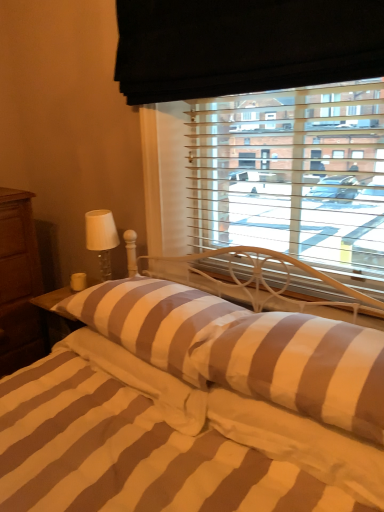
Question: Are brown striped pillow at center, positioned as the 1th pillow in right-to-left order, and striped fabric bed at center far apart?

Choices:
 (A) no
 (B) yes

Answer: (A)

Question: Can you confirm if brown striped pillow at center, positioned as the second pillow in left-to-right order, is bigger than striped fabric bed at center?

Choices:
 (A) no
 (B) yes

Answer: (A)

Question: Is brown striped pillow at center, positioned as the 1th pillow in right-to-left order, with striped fabric bed at center?

Choices:
 (A) no
 (B) yes

Answer: (A)

Question: Can you confirm if brown striped pillow at center, positioned as the second pillow in left-to-right order, is positioned to the right of striped fabric bed at center?

Choices:
 (A) no
 (B) yes

Answer: (B)

Question: Is brown striped pillow at center, positioned as the second pillow in left-to-right order, aimed at striped fabric bed at center?

Choices:
 (A) yes
 (B) no

Answer: (A)

Question: Choose the correct answer: Is brown striped pillow at center, which is the second pillow from right to left, inside white glass table lamp at left or outside it?

Choices:
 (A) outside
 (B) inside

Answer: (A)

Question: From a real-world perspective, is brown striped pillow at center, which is the second pillow from right to left, physically located above or below white glass table lamp at left?

Choices:
 (A) below
 (B) above

Answer: (A)

Question: Considering their positions, is brown striped pillow at center, the 1th pillow in the left-to-right sequence, located in front of or behind white glass table lamp at left?

Choices:
 (A) behind
 (B) front

Answer: (B)

Question: From the image's perspective, relative to white glass table lamp at left, is brown striped pillow at center, the 1th pillow in the left-to-right sequence, above or below?

Choices:
 (A) above
 (B) below

Answer: (B)

Question: From the image's perspective, is brown striped pillow at center, positioned as the 1th pillow in right-to-left order, located above or below striped fabric bed at center?

Choices:
 (A) above
 (B) below

Answer: (A)

Question: Visually, is brown striped pillow at center, positioned as the second pillow in left-to-right order, positioned to the left or to the right of striped fabric bed at center?

Choices:
 (A) left
 (B) right

Answer: (B)

Question: From a real-world perspective, is brown striped pillow at center, positioned as the 1th pillow in right-to-left order, above or below striped fabric bed at center?

Choices:
 (A) above
 (B) below

Answer: (A)

Question: Based on their sizes in the image, would you say brown striped pillow at center, positioned as the 1th pillow in right-to-left order, is bigger or smaller than striped fabric bed at center?

Choices:
 (A) big
 (B) small

Answer: (B)

Question: From their relative heights in the image, would you say white glass table lamp at left is taller or shorter than striped fabric bed at center?

Choices:
 (A) tall
 (B) short

Answer: (B)

Question: In terms of size, does white glass table lamp at left appear bigger or smaller than striped fabric bed at center?

Choices:
 (A) big
 (B) small

Answer: (B)